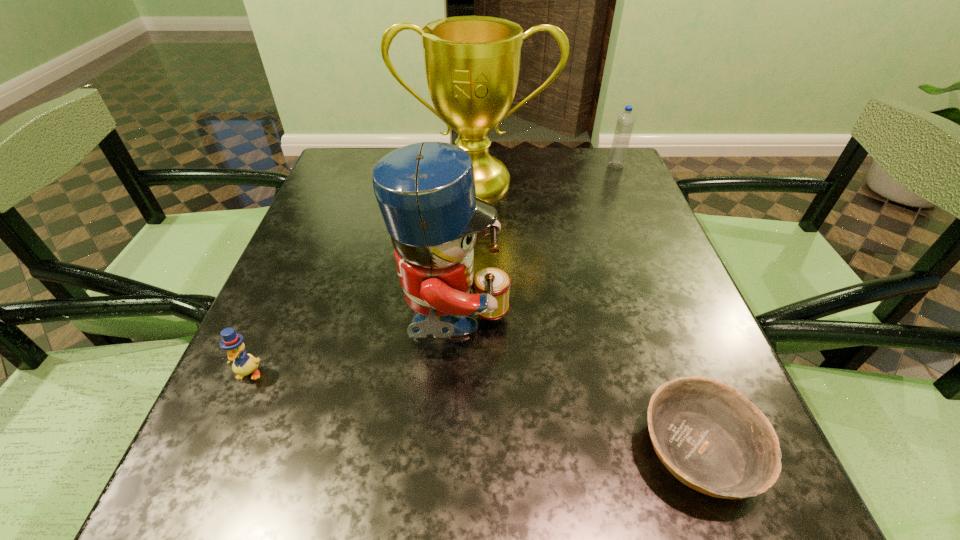
This screenshot has height=540, width=960. What are the coordinates of `vacant space that satisfies the following two spatial constraints: 1. on the shiny surface of the award; 2. on the front-facing side of the nutcracker` in the screenshot? It's located at 474,326.

This screenshot has width=960, height=540. What are the coordinates of `vacant space that satisfies the following two spatial constraints: 1. on the shiny surface of the award; 2. on the left side of the shortest object` in the screenshot? It's located at (472, 450).

At what (x,y) coordinates should I click in order to perform the action: click on vacant space that satisfies the following two spatial constraints: 1. on the shiny surface of the award; 2. on the front-facing side of the nutcracker. Please return your answer as a coordinate pair (x, y). Looking at the image, I should click on (474, 326).